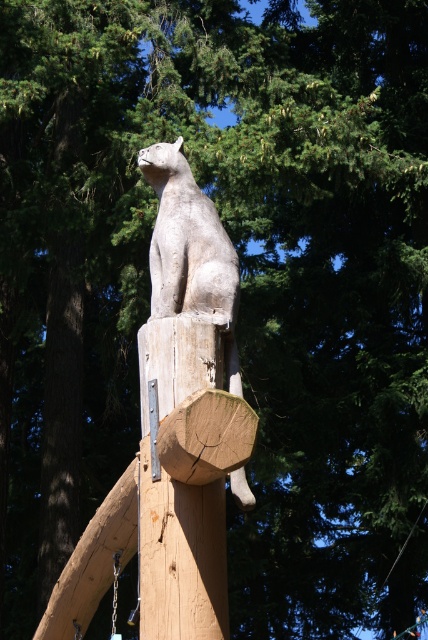
Question: In this image, where is natural wood log at center located relative to gray wood cat at center?

Choices:
 (A) above
 (B) below

Answer: (B)

Question: Is natural wood log at center smaller than gray stone cat at center?

Choices:
 (A) no
 (B) yes

Answer: (B)

Question: Which point is farther to the camera?

Choices:
 (A) dark brown wood at left
 (B) gray wood cat at center
 (C) natural wood log at center
 (D) gray stone cat at center

Answer: (A)

Question: Which of the following is the closest to the observer?

Choices:
 (A) (186, 522)
 (B) (148, 150)
 (C) (82, 298)
 (D) (217, 224)

Answer: (A)

Question: Estimate the real-world distances between objects in this image. Which object is closer to the natural wood log at center?

Choices:
 (A) gray wood cat at center
 (B) gray stone cat at center
 (C) dark brown wood at left

Answer: (A)

Question: Is natural wood log at center above gray stone cat at center?

Choices:
 (A) yes
 (B) no

Answer: (B)